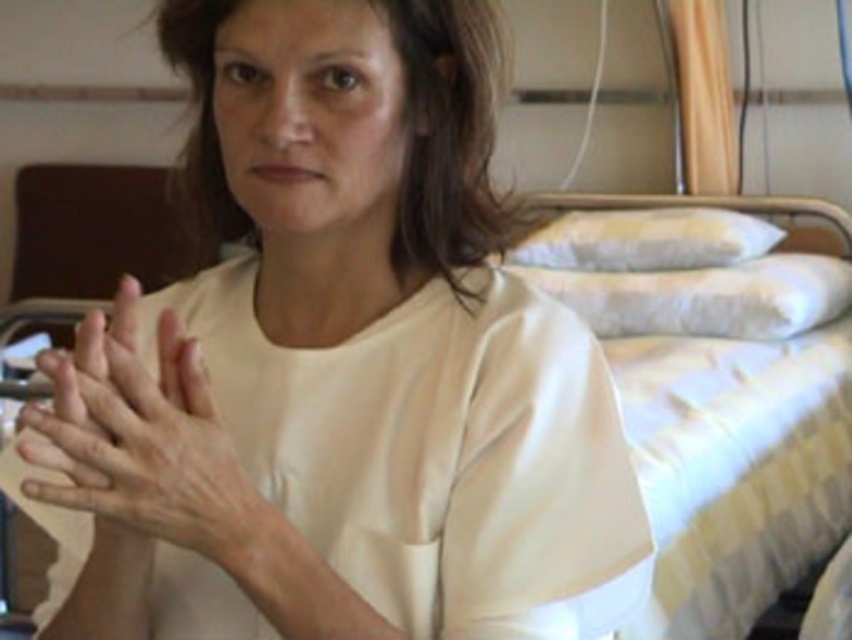
Is dry skin hands at center taller than white soft pillow at right?

Incorrect, dry skin hands at center's height is not larger of white soft pillow at right's.

Is point (182, 426) positioned in front of point (838, 296)?

That is True.

I want to click on dry skin hands at center, so tap(139, 438).

Can you confirm if white soft pillow at right is thinner than yellow striped pillow at upper right?

Incorrect, white soft pillow at right's width is not less than yellow striped pillow at upper right's.

Measure the distance from white soft pillow at right to yellow striped pillow at upper right.

white soft pillow at right and yellow striped pillow at upper right are 11.06 centimeters apart.

Locate an element on the screen. Image resolution: width=852 pixels, height=640 pixels. white soft pillow at right is located at coordinates (705, 296).

Does dry skin hands at center have a lesser width compared to yellow striped pillow at upper right?

Indeed, dry skin hands at center has a lesser width compared to yellow striped pillow at upper right.

Is dry skin hands at center above yellow striped pillow at upper right?

No, dry skin hands at center is not above yellow striped pillow at upper right.

Between point (114, 339) and point (579, 216), which one is positioned behind?

Point (579, 216)

Find the location of a particular element. The width and height of the screenshot is (852, 640). dry skin hands at center is located at coordinates (139, 438).